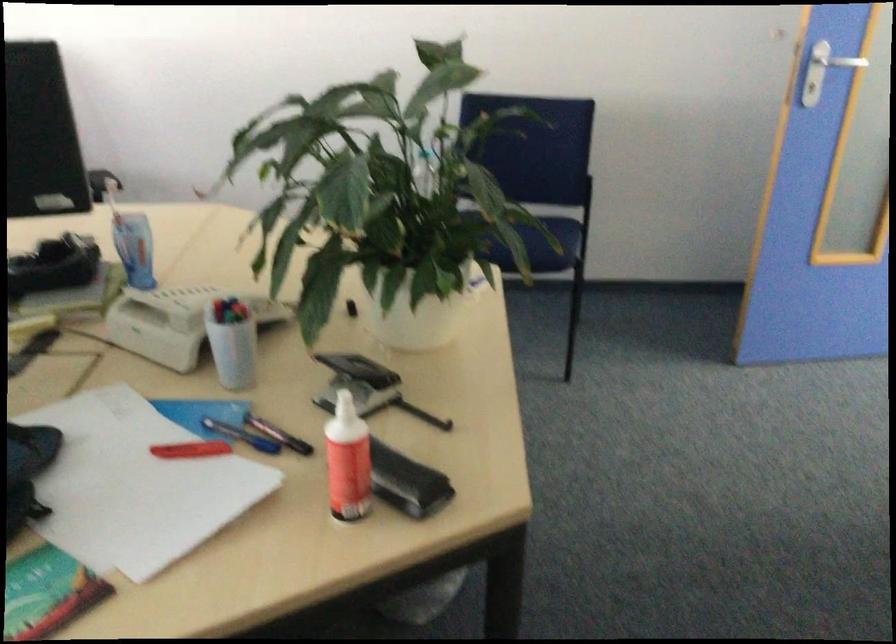
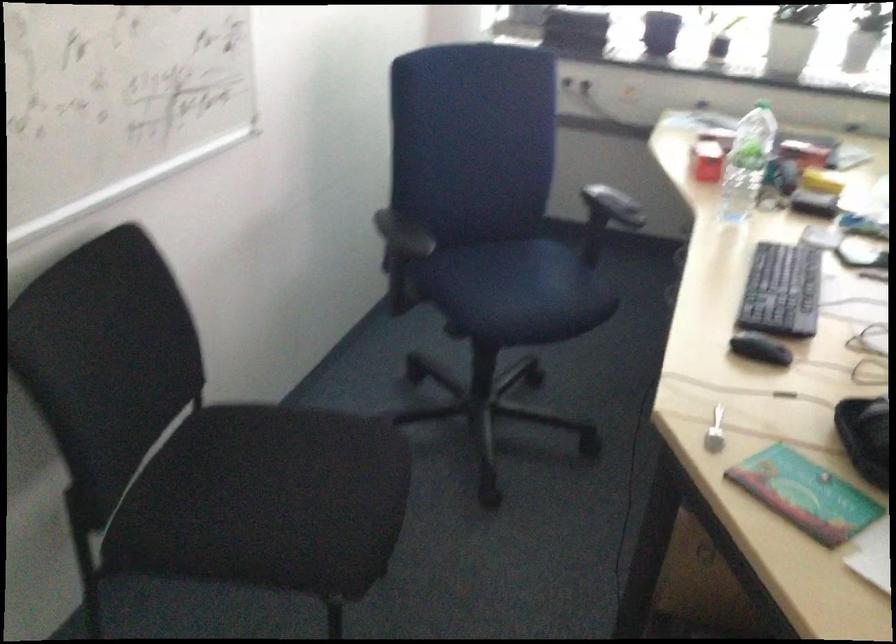
Based on the continuous images, in which direction is the camera rotating?

The camera's rotation is toward left-down.